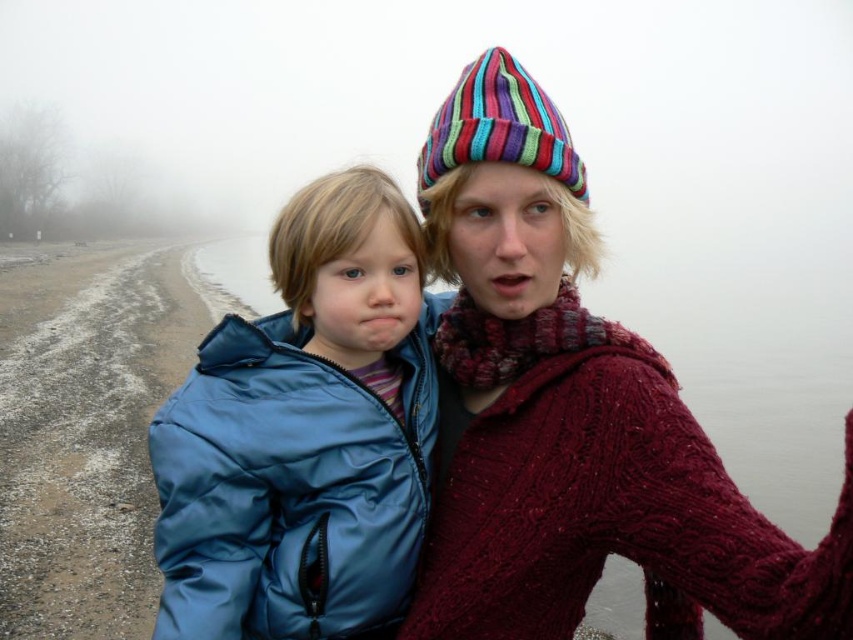
You are a photographer trying to capture a clear shot of both the blue puffy jacket at left and the multicolored knitted beanie at upper center. Since the fog is quite thick, you need to adjust your camera focus. Which object should you focus on first to ensure it appears sharp in the photo?

The blue puffy jacket at left is taller than the multicolored knitted beanie at upper center, so focusing on the blue puffy jacket at left first will ensure it is in sharp focus before adjusting for the smaller beanie.

You are a tailor measuring the distance between two knitted items for a custom order. You see the knitted maroon sweater at center and the multicolored knitted beanie at upper center. Can you determine if the distance between them is sufficient to fit a 24 inch wide decorative ribbon horizontally between them?

The distance between the knitted maroon sweater at center and the multicolored knitted beanie at upper center is 23.86 inches, which is slightly less than the 24 inch wide decorative ribbon. Therefore, the ribbon would not fit horizontally between them.